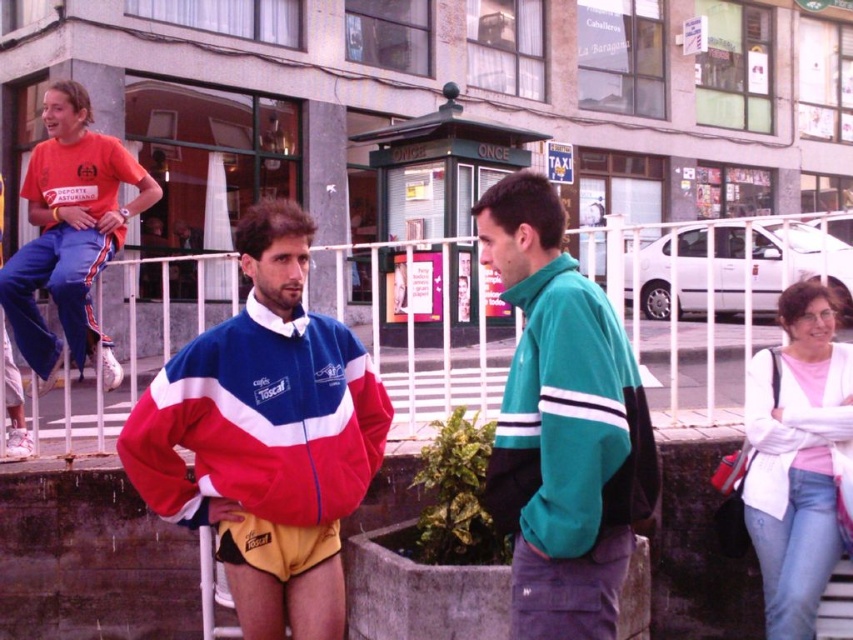
Question: Which is farther from the teal fleece jacket at center?

Choices:
 (A) pink cotton shirt at center
 (B) red and white fleece jacket at center
 (C) matte orange t-shirt at upper left
 (D) white metal rail at upper center

Answer: (D)

Question: Is white metal rail at upper center bigger than pink cotton shirt at center?

Choices:
 (A) no
 (B) yes

Answer: (B)

Question: In this image, where is red and white fleece jacket at center located relative to pink cotton shirt at center?

Choices:
 (A) above
 (B) below

Answer: (A)

Question: Based on their relative distances, which object is farther from the matte orange t-shirt at upper left?

Choices:
 (A) red and white fleece jacket at center
 (B) pink cotton shirt at center

Answer: (B)

Question: Considering the relative positions of white metal rail at upper center and matte orange t-shirt at upper left in the image provided, where is white metal rail at upper center located with respect to matte orange t-shirt at upper left?

Choices:
 (A) right
 (B) left

Answer: (A)

Question: Considering the real-world distances, which object is farthest from the pink cotton shirt at center?

Choices:
 (A) matte orange t-shirt at upper left
 (B) red and white fleece jacket at center
 (C) white metal rail at upper center

Answer: (C)